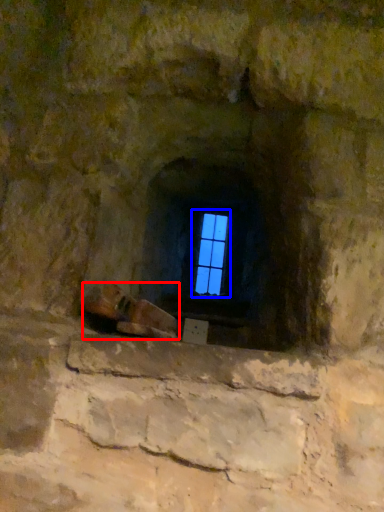
Question: Which point is closer to the camera, footwear (highlighted by a red box) or window (highlighted by a blue box)?

Choices:
 (A) footwear
 (B) window

Answer: (A)